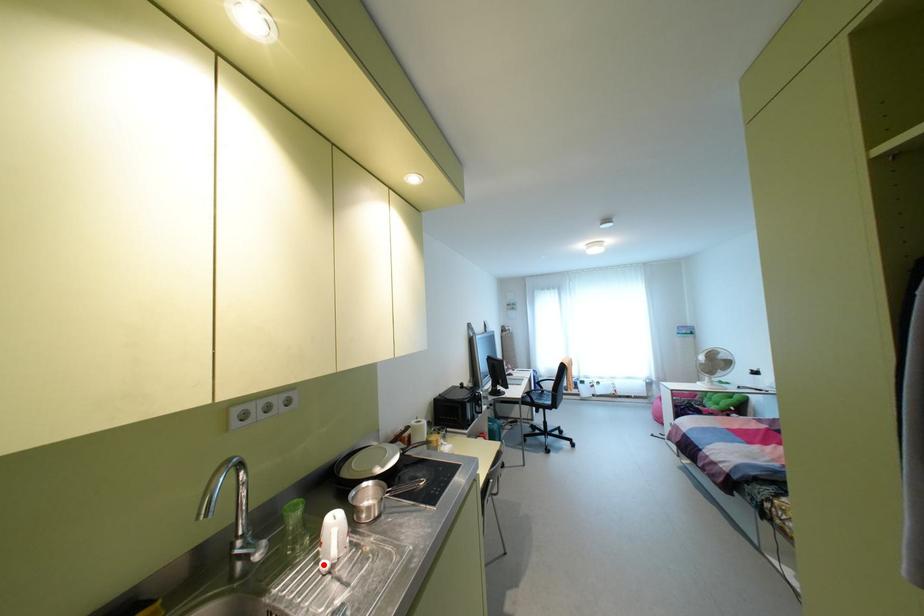
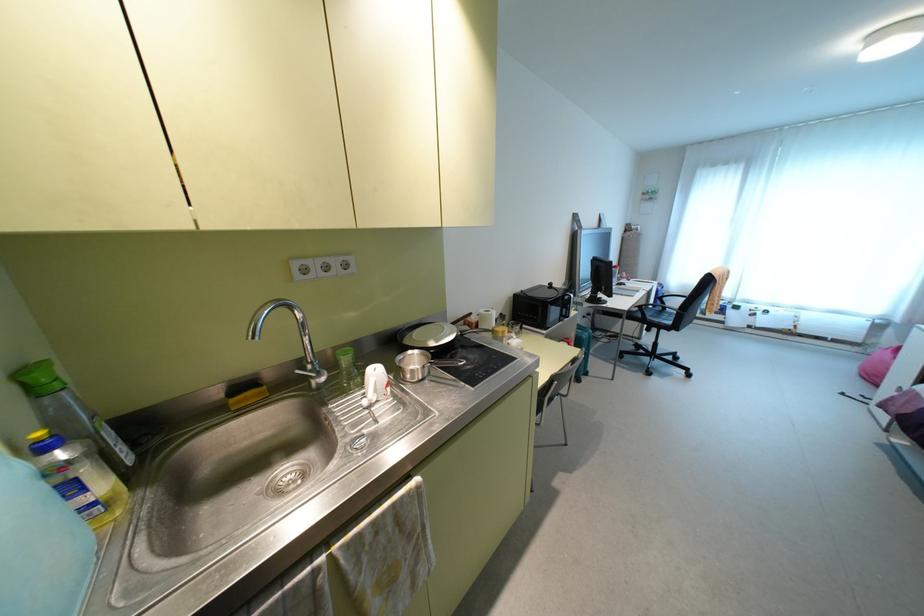
In the second image, find the point that corresponds to the highlighted location in the first image.

(365, 400)